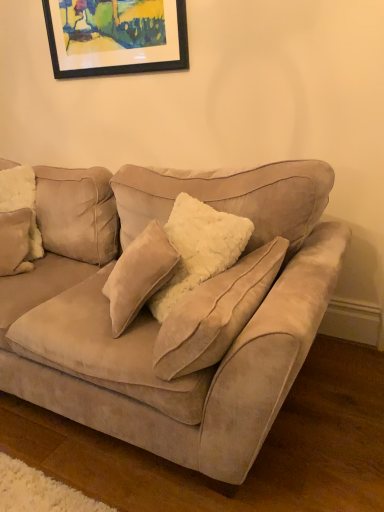
Question: Is fuzzy beige pillow at left in front of black framed picture at upper center?

Choices:
 (A) no
 (B) yes

Answer: (B)

Question: Is black framed picture at upper center a part of fuzzy beige pillow at left?

Choices:
 (A) yes
 (B) no

Answer: (B)

Question: Would you consider fuzzy beige pillow at left to be distant from black framed picture at upper center?

Choices:
 (A) yes
 (B) no

Answer: (B)

Question: From a real-world perspective, does fuzzy beige pillow at left stand above black framed picture at upper center?

Choices:
 (A) yes
 (B) no

Answer: (B)

Question: Does fuzzy beige pillow at left have a larger size compared to black framed picture at upper center?

Choices:
 (A) no
 (B) yes

Answer: (A)

Question: Is the depth of fuzzy beige pillow at left greater than that of black framed picture at upper center?

Choices:
 (A) yes
 (B) no

Answer: (B)

Question: Is suede couch at center beside fuzzy beige pillow at left?

Choices:
 (A) yes
 (B) no

Answer: (B)

Question: Is suede couch at center taller than fuzzy beige pillow at left?

Choices:
 (A) yes
 (B) no

Answer: (A)

Question: From the image's perspective, is suede couch at center located beneath fuzzy beige pillow at left?

Choices:
 (A) no
 (B) yes

Answer: (B)

Question: Is suede couch at center not inside fuzzy beige pillow at left?

Choices:
 (A) yes
 (B) no

Answer: (A)

Question: Is the position of suede couch at center more distant than that of fuzzy beige pillow at left?

Choices:
 (A) no
 (B) yes

Answer: (A)

Question: Would you say suede couch at center is a long distance from fuzzy beige pillow at left?

Choices:
 (A) no
 (B) yes

Answer: (A)

Question: Is suede couch at center positioned before black framed picture at upper center?

Choices:
 (A) yes
 (B) no

Answer: (A)